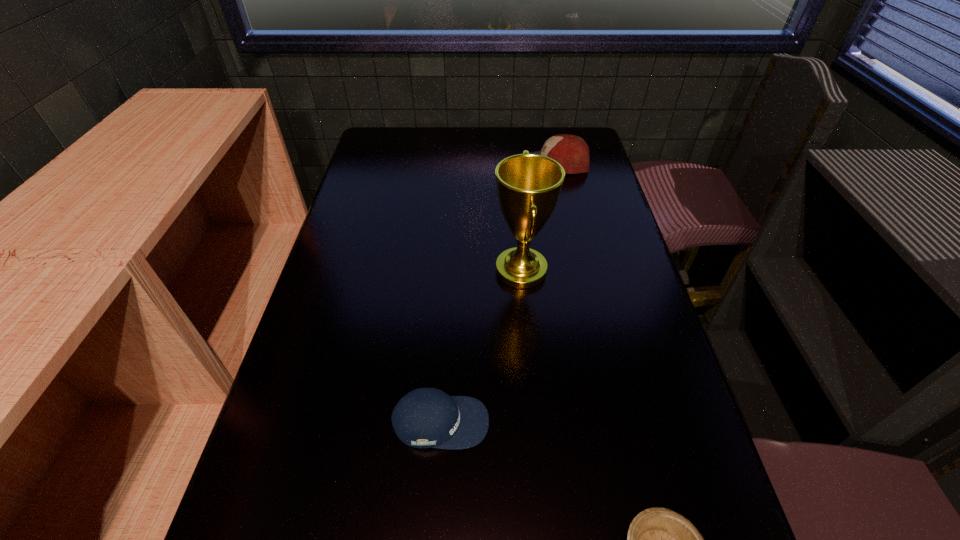
I want to click on vacant space located on the front-facing side of the right baseball cap, so click(420, 164).

The height and width of the screenshot is (540, 960). I want to click on vacant space situated 0.300m on the front-facing side of the right baseball cap, so click(432, 164).

Where is `vacant space located 0.210m on the front-facing side of the leftmost object`? vacant space located 0.210m on the front-facing side of the leftmost object is located at coordinates (596, 422).

The width and height of the screenshot is (960, 540). Find the location of `object situated at the far edge`. object situated at the far edge is located at coordinates (570, 151).

The image size is (960, 540). Identify the location of object that is at the right edge. (570, 151).

You are a GUI agent. You are given a task and a screenshot of the screen. Output one action in this format:
    pyautogui.click(x=<x>, y=<y>)
    Task: Click on the object that is at the far right corner
    This screenshot has width=960, height=540.
    Given the screenshot: What is the action you would take?
    pyautogui.click(x=570, y=151)

This screenshot has height=540, width=960. I want to click on free space at the far edge, so click(x=419, y=144).

Find the location of a particular element. The height and width of the screenshot is (540, 960). vacant space at the left edge of the desktop is located at coordinates tap(353, 363).

What are the coordinates of `vacant space at the right edge of the desktop` in the screenshot? It's located at (578, 204).

Find the location of a particular element. This screenshot has height=540, width=960. vacant space at the far left corner is located at coordinates (412, 136).